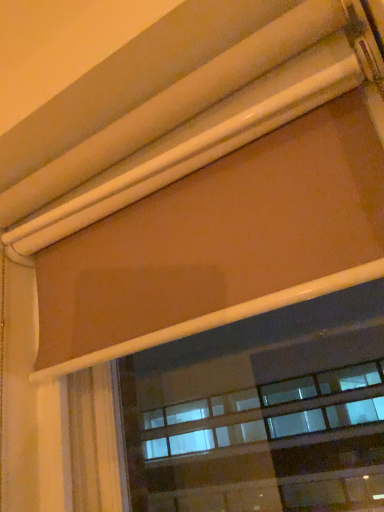
The width and height of the screenshot is (384, 512). Describe the element at coordinates (199, 122) in the screenshot. I see `matte brown roller blind at upper center` at that location.

Measure the distance between matte brown roller blind at upper center and camera.

The distance of matte brown roller blind at upper center from camera is 19.66 inches.

At what (x,y) coordinates should I click in order to perform the action: click on matte brown roller blind at upper center. Please return your answer as a coordinate pair (x, y). The width and height of the screenshot is (384, 512). Looking at the image, I should click on (199, 122).

The image size is (384, 512). Find the location of `matte brown roller blind at upper center`. matte brown roller blind at upper center is located at coordinates (199, 122).